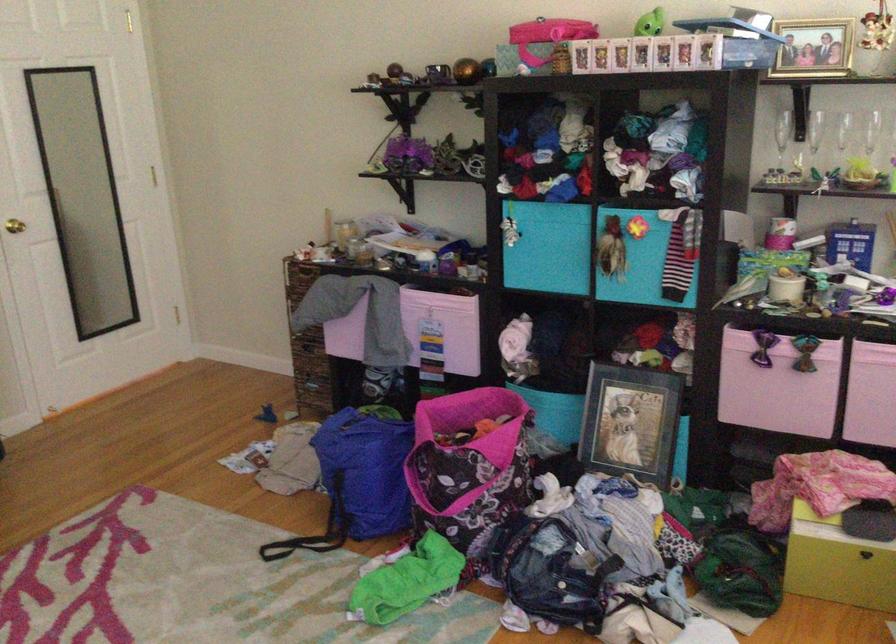
What are the coordinates of `pink bin bow handle` in the screenshot? It's located at (762, 353).